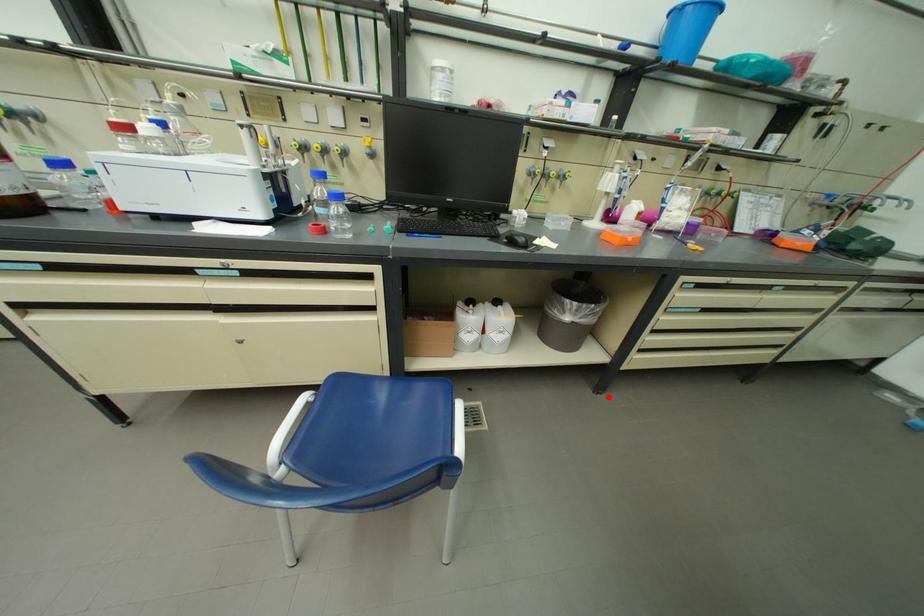
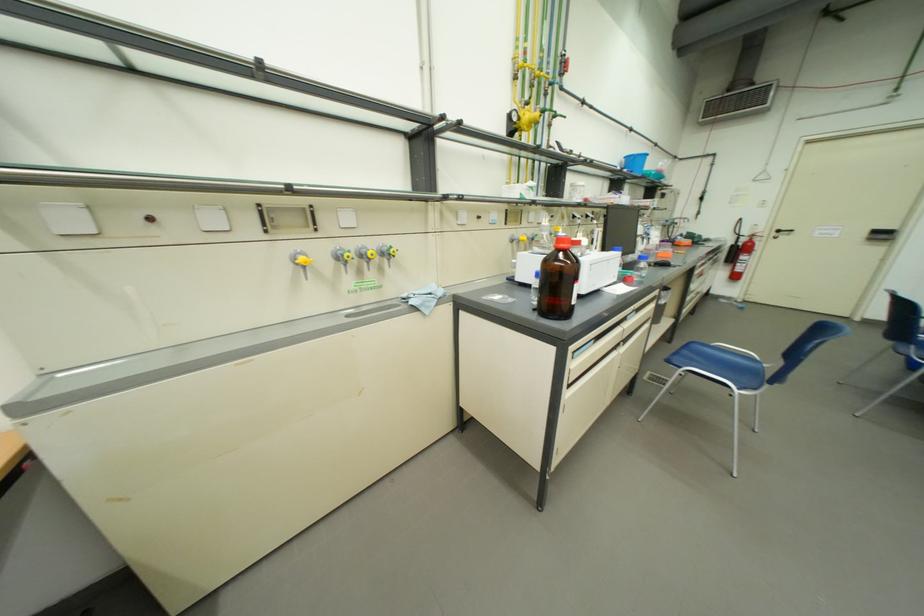
Question: I am providing you with two images of the same scene from different viewpoints. In image1, a red point is highlighted. Considering the same 3D point in image2, which of the following is correct?

Choices:
 (A) It is closer
 (B) It is farther

Answer: (B)